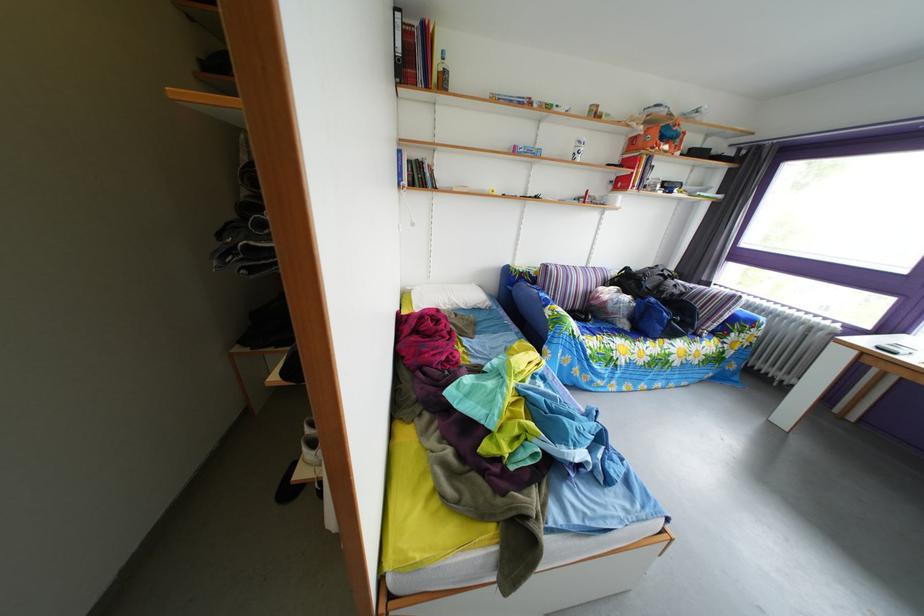
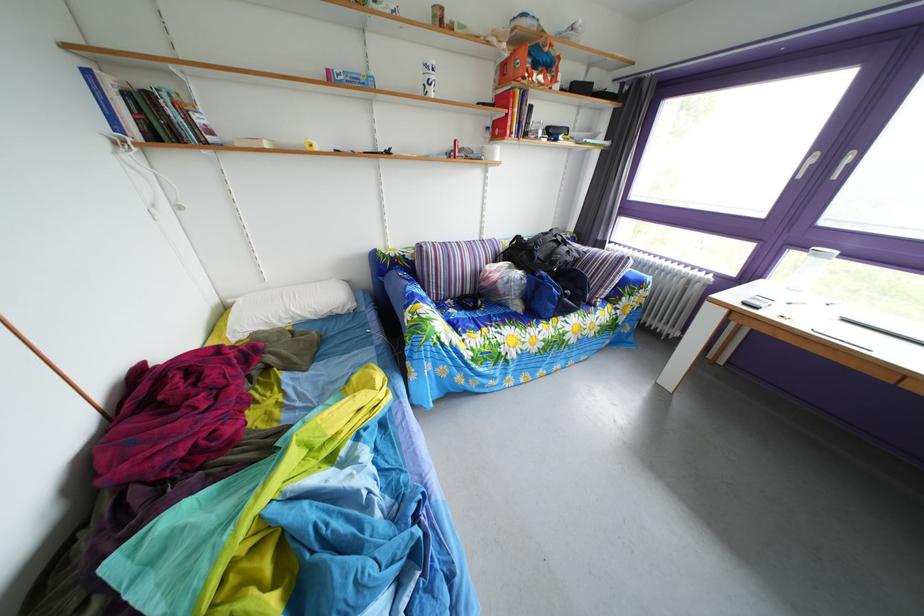
Locate, in the second image, the point that corresponds to the point at 526,155 in the first image.

(339, 79)